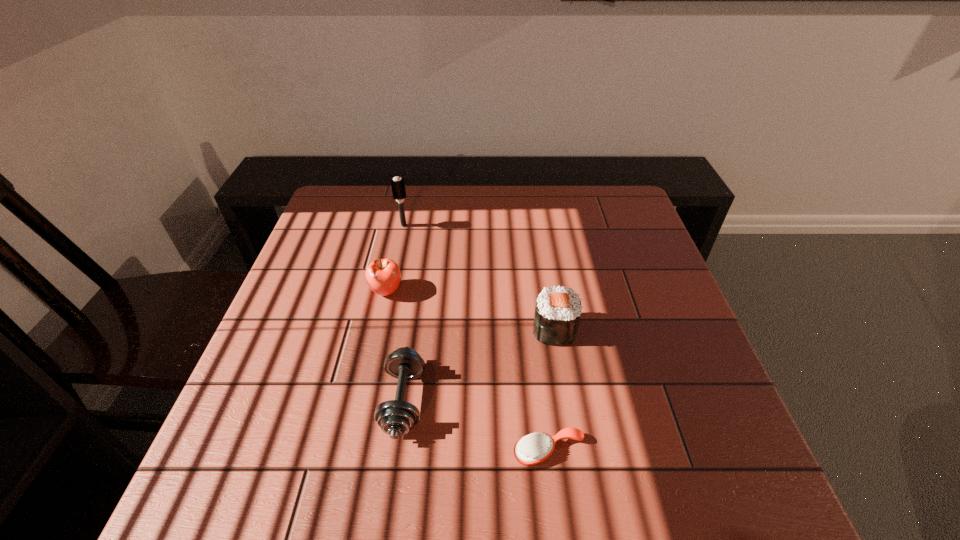
You are a GUI agent. You are given a task and a screenshot of the screen. Output one action in this format:
    pyautogui.click(x=<x>, y=<y>)
    Task: Click on the vacant area that lies between the taller hairbrush and the apple
    This screenshot has height=540, width=960.
    Given the screenshot: What is the action you would take?
    pyautogui.click(x=396, y=258)

Locate an element on the screen. The image size is (960, 540). empty space that is in between the taller hairbrush and the nearer hairbrush is located at coordinates (476, 338).

Where is `free space between the taller hairbrush and the right hairbrush`? The image size is (960, 540). free space between the taller hairbrush and the right hairbrush is located at coordinates (476, 338).

The height and width of the screenshot is (540, 960). I want to click on free spot between the dumbbell and the apple, so click(x=395, y=346).

Locate an element on the screen. free space between the nearer hairbrush and the apple is located at coordinates (468, 371).

Identify the location of vacant space that's between the shorter hairbrush and the taller hairbrush. This screenshot has height=540, width=960. point(476,338).

At what (x,y) coordinates should I click in order to perform the action: click on empty space that is in between the apple and the fourth tallest object. Please return your answer as a coordinate pair (x, y). The width and height of the screenshot is (960, 540). Looking at the image, I should click on (395, 346).

Locate an element on the screen. The height and width of the screenshot is (540, 960). free space between the third nearest object and the apple is located at coordinates [x=470, y=310].

Find the location of `free space between the nearer hairbrush and the tallest object`. free space between the nearer hairbrush and the tallest object is located at coordinates (476, 338).

At what (x,y) coordinates should I click in order to perform the action: click on unoccupied position between the third farthest object and the apple. Please return your answer as a coordinate pair (x, y). This screenshot has height=540, width=960. Looking at the image, I should click on (470, 310).